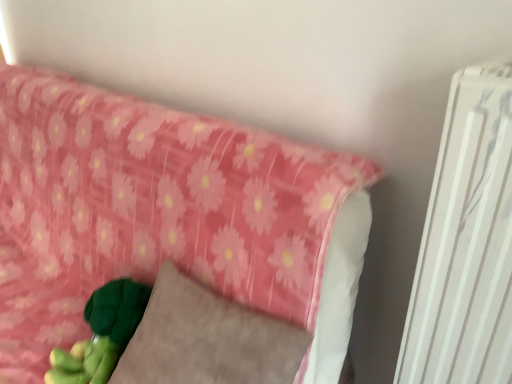
Question: Can you confirm if pink fabric pillow at upper left is smaller than velvety gray pillow at lower left?

Choices:
 (A) yes
 (B) no

Answer: (B)

Question: From a real-world perspective, is pink fabric pillow at upper left over velvety gray pillow at lower left?

Choices:
 (A) no
 (B) yes

Answer: (A)

Question: Is pink fabric pillow at upper left outside of velvety gray pillow at lower left?

Choices:
 (A) no
 (B) yes

Answer: (B)

Question: Can you confirm if pink fabric pillow at upper left is wider than velvety gray pillow at lower left?

Choices:
 (A) yes
 (B) no

Answer: (A)

Question: Can you confirm if pink fabric pillow at upper left is shorter than velvety gray pillow at lower left?

Choices:
 (A) yes
 (B) no

Answer: (B)

Question: Considering the relative sizes of pink fabric pillow at upper left and velvety gray pillow at lower left in the image provided, is pink fabric pillow at upper left bigger than velvety gray pillow at lower left?

Choices:
 (A) yes
 (B) no

Answer: (A)

Question: Considering the relative sizes of velvety gray pillow at lower left and pink fabric pillow at upper left in the image provided, is velvety gray pillow at lower left wider than pink fabric pillow at upper left?

Choices:
 (A) yes
 (B) no

Answer: (B)

Question: Does velvety gray pillow at lower left have a greater height compared to pink fabric pillow at upper left?

Choices:
 (A) no
 (B) yes

Answer: (A)

Question: Is velvety gray pillow at lower left positioned before pink fabric pillow at upper left?

Choices:
 (A) yes
 (B) no

Answer: (B)

Question: Is velvety gray pillow at lower left smaller than pink fabric pillow at upper left?

Choices:
 (A) yes
 (B) no

Answer: (A)

Question: From the image's perspective, is velvety gray pillow at lower left on pink fabric pillow at upper left?

Choices:
 (A) no
 (B) yes

Answer: (A)

Question: From a real-world perspective, is velvety gray pillow at lower left beneath pink fabric pillow at upper left?

Choices:
 (A) yes
 (B) no

Answer: (B)

Question: Is velvety gray pillow at lower left inside or outside of pink fabric pillow at upper left?

Choices:
 (A) outside
 (B) inside

Answer: (B)